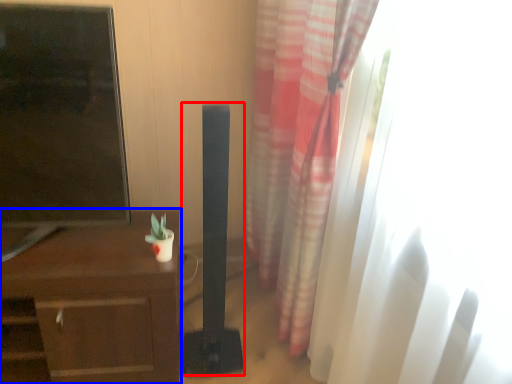
Question: Among these objects, which one is farthest to the camera, speaker (highlighted by a red box) or desk (highlighted by a blue box)?

Choices:
 (A) speaker
 (B) desk

Answer: (B)